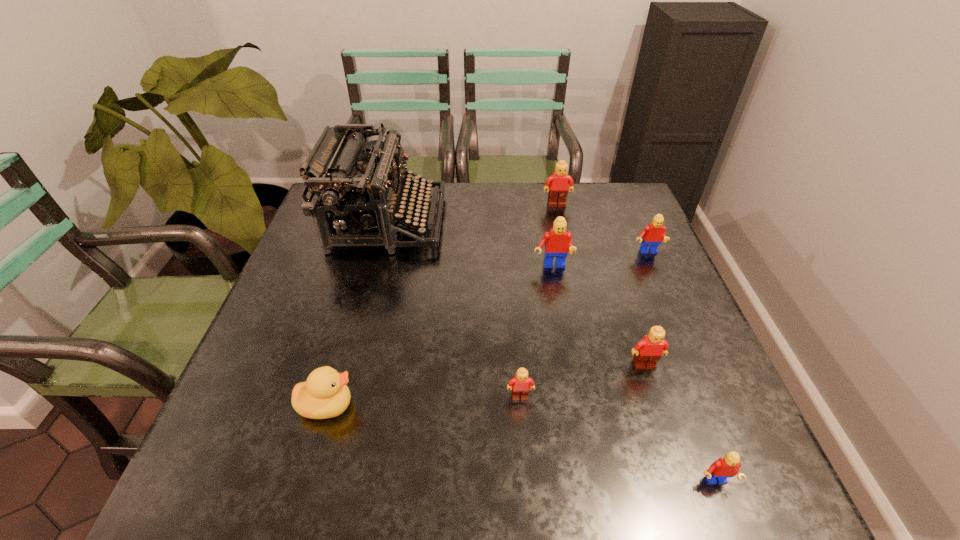
Where is `the tallest object`? the tallest object is located at coordinates (355, 200).

At what (x,y) coordinates should I click in order to perform the action: click on the second brown Lego from right to left. Please return your answer as a coordinate pair (x, y). Looking at the image, I should click on (558, 189).

Find the location of `the biggest brown Lego`. the biggest brown Lego is located at coordinates (558, 189).

The height and width of the screenshot is (540, 960). In order to click on the second nearest red Lego in this screenshot , I will do `click(558, 242)`.

You are a GUI agent. You are given a task and a screenshot of the screen. Output one action in this format:
    pyautogui.click(x=<x>, y=<y>)
    Task: Click on the biggest red Lego
    
    Given the screenshot: What is the action you would take?
    pyautogui.click(x=558, y=242)

Locate an element on the screen. Image resolution: width=960 pixels, height=540 pixels. the farthest red Lego is located at coordinates (653, 234).

Locate an element on the screen. This screenshot has width=960, height=540. the second farthest Lego is located at coordinates (653, 234).

Find the location of a particular element. the second biggest brown Lego is located at coordinates (648, 351).

At what (x,y) coordinates should I click in order to perform the action: click on the fourth nearest object. Please return your answer as a coordinate pair (x, y). Image resolution: width=960 pixels, height=540 pixels. Looking at the image, I should click on (648, 351).

Locate an element on the screen. yellow duckling is located at coordinates (325, 394).